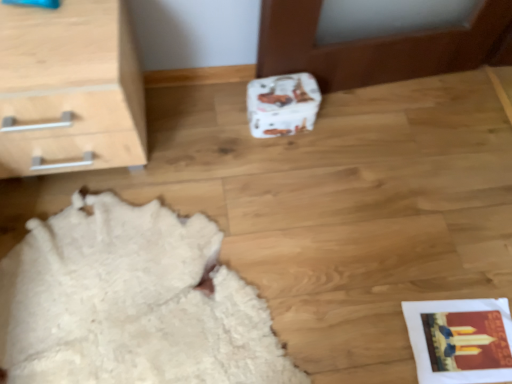
Question: Is light wood/texture chest of drawers at upper left wider than white paper shoe box at center?

Choices:
 (A) yes
 (B) no

Answer: (A)

Question: Are light wood/texture chest of drawers at upper left and white paper shoe box at center far apart?

Choices:
 (A) yes
 (B) no

Answer: (B)

Question: Is the position of light wood/texture chest of drawers at upper left less distant than that of white paper shoe box at center?

Choices:
 (A) no
 (B) yes

Answer: (B)

Question: Is white paper shoe box at center at the back of light wood/texture chest of drawers at upper left?

Choices:
 (A) yes
 (B) no

Answer: (B)

Question: Considering the relative sizes of light wood/texture chest of drawers at upper left and white paper shoe box at center in the image provided, is light wood/texture chest of drawers at upper left thinner than white paper shoe box at center?

Choices:
 (A) no
 (B) yes

Answer: (A)

Question: From a real-world perspective, is light wood/texture chest of drawers at upper left positioned above or below white fluffy rug at lower left?

Choices:
 (A) above
 (B) below

Answer: (A)

Question: Is light wood/texture chest of drawers at upper left in front of or behind white fluffy rug at lower left in the image?

Choices:
 (A) front
 (B) behind

Answer: (A)

Question: Would you say light wood/texture chest of drawers at upper left is inside or outside white fluffy rug at lower left?

Choices:
 (A) inside
 (B) outside

Answer: (B)

Question: Does point (68, 54) appear closer or farther from the camera than point (101, 349)?

Choices:
 (A) farther
 (B) closer

Answer: (B)

Question: Considering the positions of light wood/texture chest of drawers at upper left and white paper shoe box at center in the image, is light wood/texture chest of drawers at upper left wider or thinner than white paper shoe box at center?

Choices:
 (A) wide
 (B) thin

Answer: (A)

Question: From the image's perspective, is light wood/texture chest of drawers at upper left located above or below white paper shoe box at center?

Choices:
 (A) above
 (B) below

Answer: (A)

Question: From a real-world perspective, relative to white paper shoe box at center, is light wood/texture chest of drawers at upper left vertically above or below?

Choices:
 (A) below
 (B) above

Answer: (B)

Question: Relative to white paper shoe box at center, is light wood/texture chest of drawers at upper left in front or behind?

Choices:
 (A) front
 (B) behind

Answer: (A)

Question: Visually, is white paper shoe box at center positioned to the left or to the right of white fluffy rug at lower left?

Choices:
 (A) left
 (B) right

Answer: (B)

Question: Would you say white paper shoe box at center is inside or outside white fluffy rug at lower left?

Choices:
 (A) outside
 (B) inside

Answer: (A)